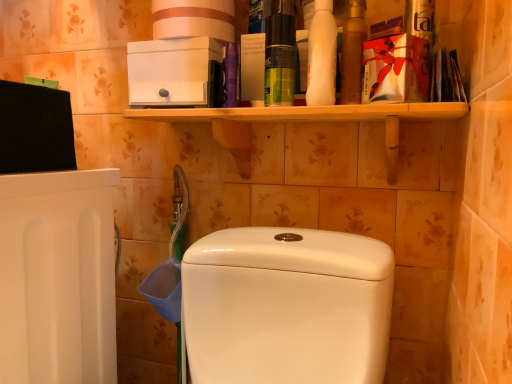
Question: Can you confirm if white cardboard toilet paper at upper center is shorter than gold metallic mouthwash at upper right?

Choices:
 (A) no
 (B) yes

Answer: (B)

Question: Is white cardboard toilet paper at upper center smaller than gold metallic mouthwash at upper right?

Choices:
 (A) no
 (B) yes

Answer: (A)

Question: Is white cardboard toilet paper at upper center in contact with gold metallic mouthwash at upper right?

Choices:
 (A) yes
 (B) no

Answer: (B)

Question: Would you say white cardboard toilet paper at upper center is outside gold metallic mouthwash at upper right?

Choices:
 (A) yes
 (B) no

Answer: (A)

Question: Does white cardboard toilet paper at upper center appear on the left side of gold metallic mouthwash at upper right?

Choices:
 (A) no
 (B) yes

Answer: (B)

Question: In terms of width, does green matte spray can at upper center, the second cleaning product positioned from the right, look wider or thinner when compared to white matte bottle at upper right, the 1th cleaning product when ordered from right to left?

Choices:
 (A) thin
 (B) wide

Answer: (A)

Question: From their relative heights in the image, would you say green matte spray can at upper center, the second cleaning product positioned from the right, is taller or shorter than white matte bottle at upper right, the 1th cleaning product when ordered from right to left?

Choices:
 (A) short
 (B) tall

Answer: (A)

Question: Based on their sizes in the image, would you say green matte spray can at upper center, the second cleaning product positioned from the right, is bigger or smaller than white matte bottle at upper right, arranged as the second cleaning product when viewed from the left?

Choices:
 (A) small
 (B) big

Answer: (A)

Question: Visually, is green matte spray can at upper center, which is the first cleaning product in left-to-right order, positioned to the left or to the right of white matte bottle at upper right, arranged as the second cleaning product when viewed from the left?

Choices:
 (A) right
 (B) left

Answer: (B)

Question: From the image's perspective, relative to white glossy toilet at center, is white matte bottle at upper right, the 1th cleaning product when ordered from right to left, above or below?

Choices:
 (A) above
 (B) below

Answer: (A)

Question: Looking at the image, does white matte bottle at upper right, the 1th cleaning product when ordered from right to left, seem bigger or smaller compared to white glossy toilet at center?

Choices:
 (A) small
 (B) big

Answer: (A)

Question: Would you say white matte bottle at upper right, the 1th cleaning product when ordered from right to left, is inside or outside white glossy toilet at center?

Choices:
 (A) inside
 (B) outside

Answer: (B)

Question: Based on their positions, is white matte bottle at upper right, the 1th cleaning product when ordered from right to left, located to the left or right of white glossy toilet at center?

Choices:
 (A) right
 (B) left

Answer: (A)

Question: From the image's perspective, is gold metallic mouthwash at upper right positioned above or below white matte bottle at upper right, the 1th cleaning product when ordered from right to left?

Choices:
 (A) above
 (B) below

Answer: (A)

Question: Looking at the image, does gold metallic mouthwash at upper right seem bigger or smaller compared to white matte bottle at upper right, the 1th cleaning product when ordered from right to left?

Choices:
 (A) big
 (B) small

Answer: (B)